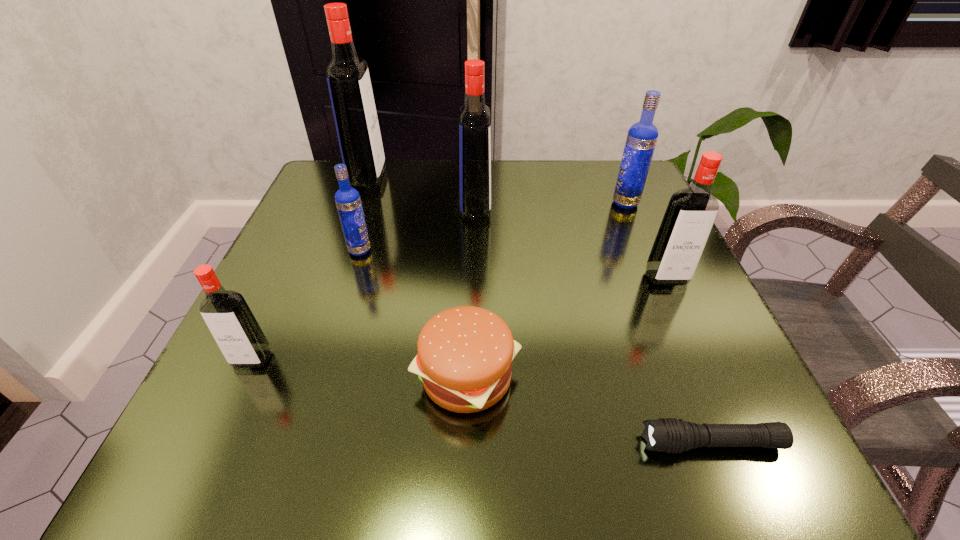
Identify the location of object at the near right corner. (671, 435).

You are a GUI agent. You are given a task and a screenshot of the screen. Output one action in this format:
    pyautogui.click(x=<x>, y=<y>)
    Task: Click on the vacant space at the far edge of the desktop
    Image resolution: width=960 pixels, height=540 pixels.
    Given the screenshot: What is the action you would take?
    pyautogui.click(x=402, y=175)

Image resolution: width=960 pixels, height=540 pixels. What are the coordinates of `vacant region at the near edge of the desktop` in the screenshot? It's located at (566, 435).

You are a GUI agent. You are given a task and a screenshot of the screen. Output one action in this format:
    pyautogui.click(x=<x>, y=<y>)
    Task: Click on the vacant space at the left edge of the desktop
    This screenshot has width=960, height=540.
    Given the screenshot: What is the action you would take?
    pyautogui.click(x=328, y=219)

The width and height of the screenshot is (960, 540). I want to click on vacant position at the right edge of the desktop, so click(627, 243).

In the image, there is a desktop. Where is `vacant space at the far left corner`? The height and width of the screenshot is (540, 960). vacant space at the far left corner is located at coordinates coord(324,184).

Where is `free location at the near left corner`? The height and width of the screenshot is (540, 960). free location at the near left corner is located at coordinates (215, 427).

Where is `vacant space at the far right corner of the desktop`? This screenshot has width=960, height=540. vacant space at the far right corner of the desktop is located at coordinates (608, 210).

Locate an element on the screen. This screenshot has width=960, height=540. free point between the fourth nearest object and the farthest vodka is located at coordinates (517, 227).

At what (x,y) coordinates should I click in order to perform the action: click on vacant area between the farther blue vodka and the nearest object. Please return your answer as a coordinate pair (x, y). Image resolution: width=960 pixels, height=540 pixels. Looking at the image, I should click on (668, 323).